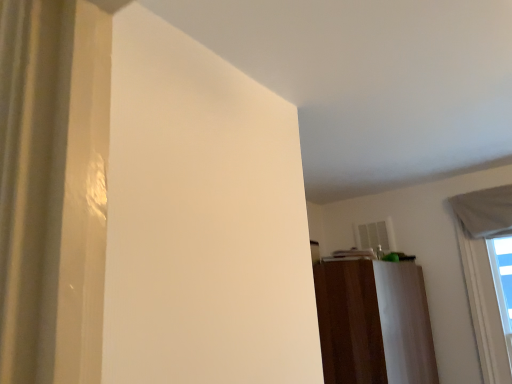
What is the approximate width of white fabric window at upper right?

white fabric window at upper right is 3.27 inches in width.

The width and height of the screenshot is (512, 384). Describe the element at coordinates (484, 272) in the screenshot. I see `white fabric window at upper right` at that location.

The image size is (512, 384). I want to click on white fabric window at upper right, so click(484, 272).

Where is `brown wood dresser at center`? brown wood dresser at center is located at coordinates (374, 323).

The height and width of the screenshot is (384, 512). What do you see at coordinates (374, 323) in the screenshot? I see `brown wood dresser at center` at bounding box center [374, 323].

Where is `white fabric window at upper right`? white fabric window at upper right is located at coordinates (484, 272).

Is brown wood dresser at center at the right side of white fabric window at upper right?

In fact, brown wood dresser at center is to the left of white fabric window at upper right.

Which object is closer to the camera taking this photo, brown wood dresser at center or white fabric window at upper right?

brown wood dresser at center.

Is point (384, 289) closer to camera compared to point (473, 242)?

Yes, it is.

From the image's perspective, is brown wood dresser at center below white fabric window at upper right?

Correct, brown wood dresser at center appears lower than white fabric window at upper right in the image.

From a real-world perspective, which object stands above the other?

white fabric window at upper right, from a real-world perspective.

Does brown wood dresser at center have a greater width compared to white fabric window at upper right?

Yes.

Considering the sizes of objects brown wood dresser at center and white fabric window at upper right in the image provided, who is shorter, brown wood dresser at center or white fabric window at upper right?

Standing shorter between the two is brown wood dresser at center.

Is brown wood dresser at center smaller than white fabric window at upper right?

No.

Is brown wood dresser at center not within white fabric window at upper right?

Absolutely, brown wood dresser at center is external to white fabric window at upper right.

Is brown wood dresser at center placed right next to white fabric window at upper right?

No, brown wood dresser at center is not touching white fabric window at upper right.

Is white fabric window at upper right at the back of brown wood dresser at center?

No, brown wood dresser at center's orientation is not away from white fabric window at upper right.

What's the angular difference between brown wood dresser at center and white fabric window at upper right's facing directions?

There is a 90-degree angle between the facing directions of brown wood dresser at center and white fabric window at upper right.

Find the location of a particular element. The height and width of the screenshot is (384, 512). window on the right of the brown wood dresser at center is located at coordinates (484, 272).

Can you confirm if white fabric window at upper right is positioned to the left of brown wood dresser at center?

Incorrect, white fabric window at upper right is not on the left side of brown wood dresser at center.

Considering the positions of objects white fabric window at upper right and brown wood dresser at center in the image provided, who is behind, white fabric window at upper right or brown wood dresser at center?

Positioned behind is white fabric window at upper right.

Which is less distant, (499, 356) or (348, 338)?

Positioned in front is point (348, 338).

From the image's perspective, is white fabric window at upper right above brown wood dresser at center?

Correct, white fabric window at upper right appears higher than brown wood dresser at center in the image.

From a real-world perspective, which is physically below, white fabric window at upper right or brown wood dresser at center?

brown wood dresser at center.

Looking at this image, which object is wider, white fabric window at upper right or brown wood dresser at center?

With larger width is brown wood dresser at center.

Which of these two, white fabric window at upper right or brown wood dresser at center, stands shorter?

brown wood dresser at center is shorter.

Between white fabric window at upper right and brown wood dresser at center, which one has smaller size?

Smaller between the two is white fabric window at upper right.

From the picture: Could brown wood dresser at center be considered to be inside white fabric window at upper right?

That's incorrect, brown wood dresser at center is not inside white fabric window at upper right.

Is white fabric window at upper right positioned far away from brown wood dresser at center?

No, white fabric window at upper right is in close proximity to brown wood dresser at center.

Is white fabric window at upper right aimed at brown wood dresser at center?

No.

At what (x,y) coordinates should I click in order to perform the action: click on window above the brown wood dresser at center (from the image's perspective). Please return your answer as a coordinate pair (x, y). The width and height of the screenshot is (512, 384). Looking at the image, I should click on (484, 272).

Image resolution: width=512 pixels, height=384 pixels. I want to click on window behind the brown wood dresser at center, so click(484, 272).

You are a GUI agent. You are given a task and a screenshot of the screen. Output one action in this format:
    pyautogui.click(x=<x>, y=<y>)
    Task: Click on the dresser on the left side of white fabric window at upper right
    The height and width of the screenshot is (384, 512).
    Given the screenshot: What is the action you would take?
    pyautogui.click(x=374, y=323)